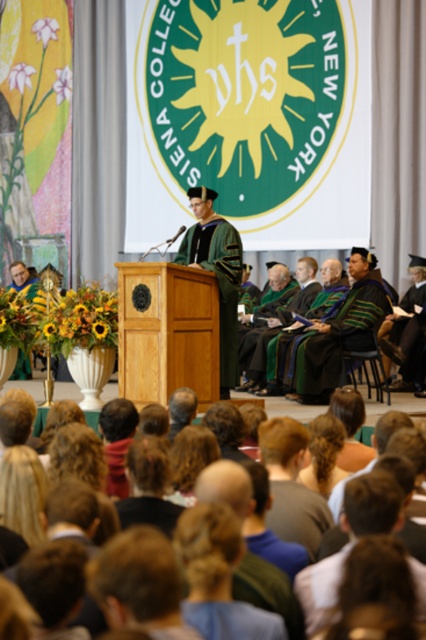
I want to click on green velvet gown at center, so click(x=216, y=273).

Consider the image. Which of these two, green velvet gown at center or green velvet robe at center, stands shorter?

Standing shorter between the two is green velvet robe at center.

Does point (224, 355) come behind point (377, 333)?

No, (224, 355) is closer to viewer.

You are a GUI agent. You are given a task and a screenshot of the screen. Output one action in this format:
    pyautogui.click(x=<x>, y=<y>)
    Task: Click on the green velvet gown at center
    The image size is (426, 640).
    Given the screenshot: What is the action you would take?
    pyautogui.click(x=216, y=273)

Which is in front, point (287, 550) or point (230, 371)?

Point (287, 550) is more forward.

Can you confirm if dark brown hair at center is taller than green velvet gown at center?

No, dark brown hair at center is not taller than green velvet gown at center.

Does point (69, 397) come farther from viewer compared to point (229, 272)?

Yes, it is.

At what (x,y) coordinates should I click in order to perform the action: click on dark brown hair at center. Please return your answer as a coordinate pair (x, y). Looking at the image, I should click on (72, 444).

Is dark brown hair at center closer to the viewer compared to green velvet robe at center?

Yes.

Does dark brown hair at center appear on the left side of green velvet robe at center?

Yes, dark brown hair at center is to the left of green velvet robe at center.

Who is more forward, (81, 420) or (412, 288)?

Point (81, 420) is more forward.

Where is `dark brown hair at center`? This screenshot has height=640, width=426. dark brown hair at center is located at coordinates (72, 444).